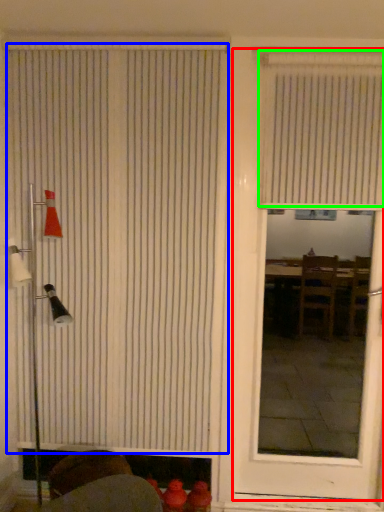
Question: Based on their relative distances, which object is farther from door (highlighted by a red box)? Choose from window blind (highlighted by a blue box) and window blind (highlighted by a green box).

Choices:
 (A) window blind
 (B) window blind

Answer: (A)